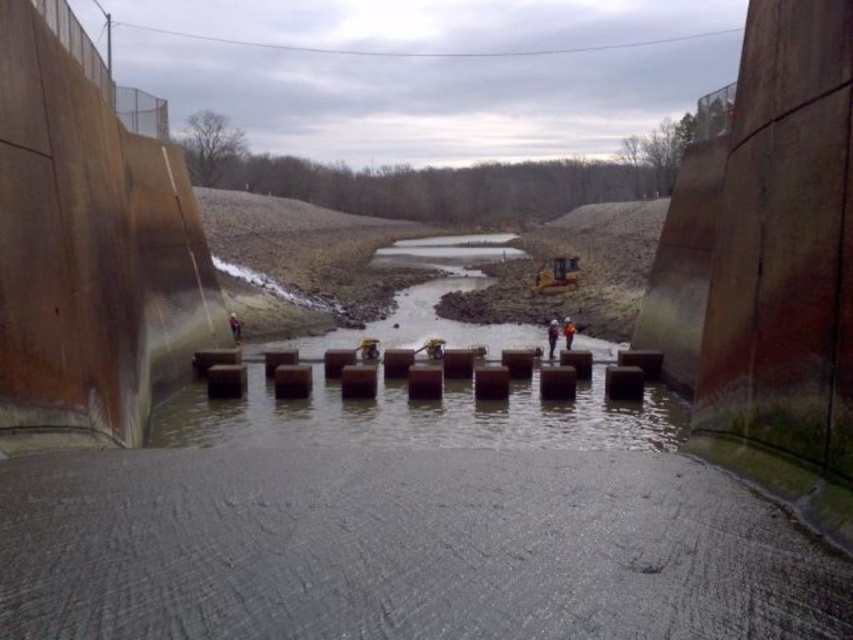
Can you confirm if white hard hat at center is positioned below orange hard hat at center?

Correct, white hard hat at center is located below orange hard hat at center.

Which is behind, point (550, 340) or point (566, 337)?

The point (566, 337) is behind.

The width and height of the screenshot is (853, 640). I want to click on white hard hat at center, so click(552, 336).